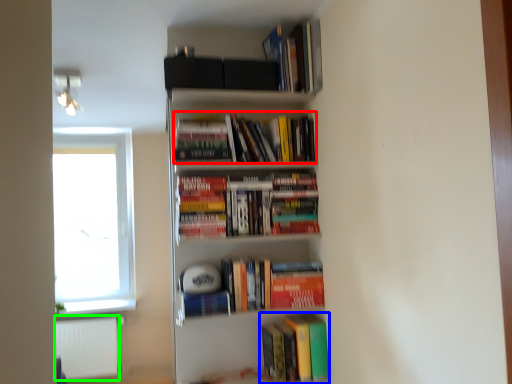
Question: Considering the real-world distances, which object is closest to book (highlighted by a red box)? book (highlighted by a blue box) or cabinet (highlighted by a green box).

Choices:
 (A) book
 (B) cabinet

Answer: (A)